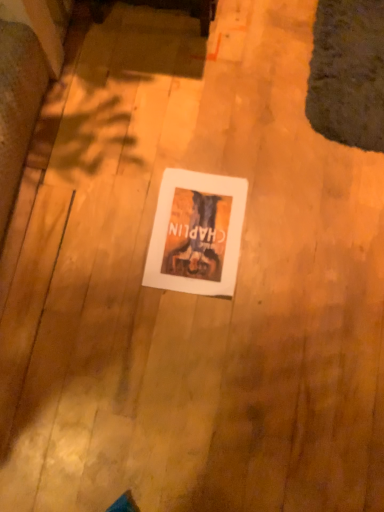
The width and height of the screenshot is (384, 512). In order to click on free spot behind white paper poster at center in this screenshot , I will do `click(196, 148)`.